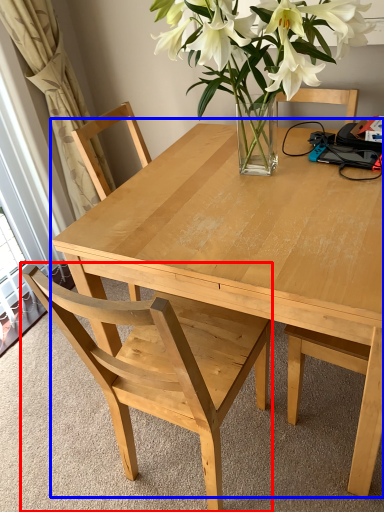
Question: Which point is closer to the camera, chair (highlighted by a red box) or kitchen & dining room table (highlighted by a blue box)?

Choices:
 (A) chair
 (B) kitchen & dining room table

Answer: (A)